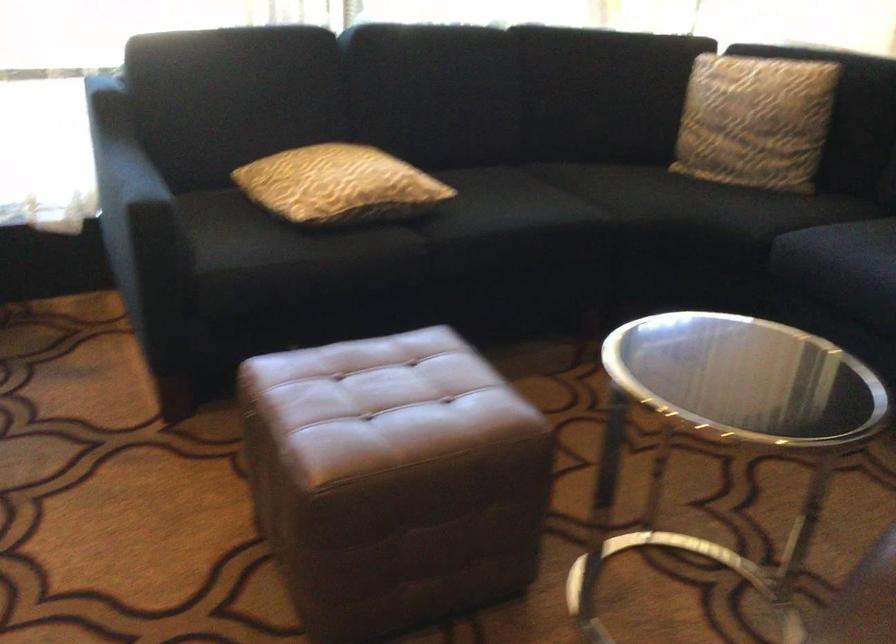
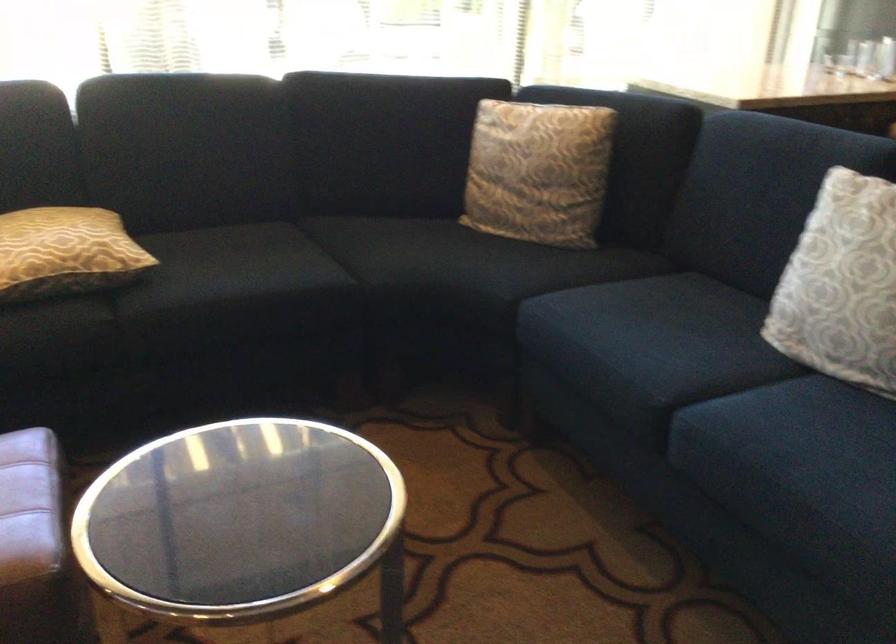
Where in the second image is the point corresponding to point 633,198 from the first image?

(391, 261)